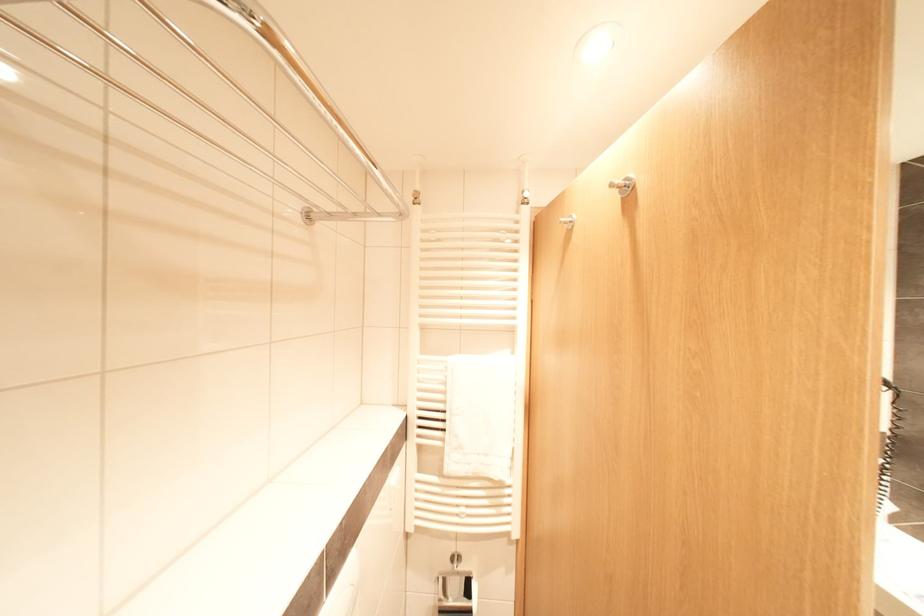
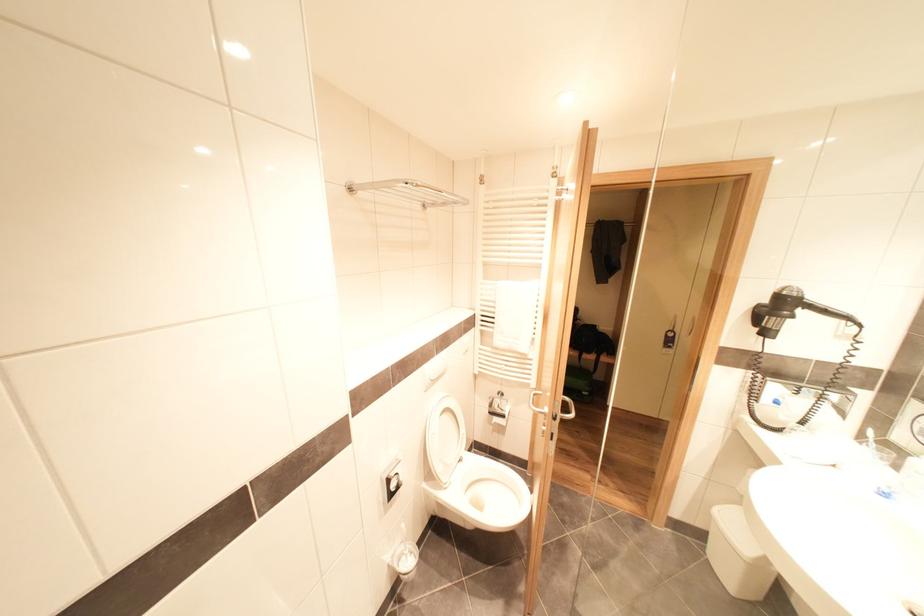
Question: The camera is either moving clockwise (left) or counter-clockwise (right) around the object. The first image is from the beginning of the video and the second image is from the end. Is the camera moving left or right when shooting the video?

Choices:
 (A) Left
 (B) Right

Answer: (B)